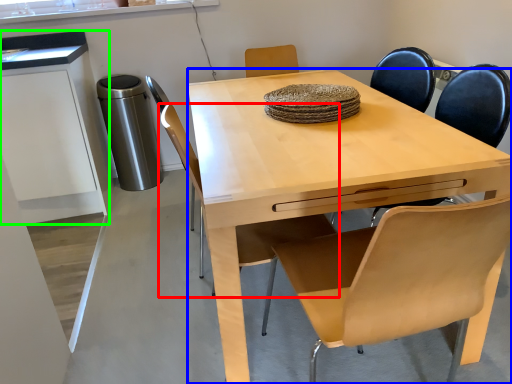
Question: Which object is positioned farthest from chair (highlighted by a red box)? Select from desk (highlighted by a blue box) and cabinetry (highlighted by a green box).

Choices:
 (A) desk
 (B) cabinetry

Answer: (B)